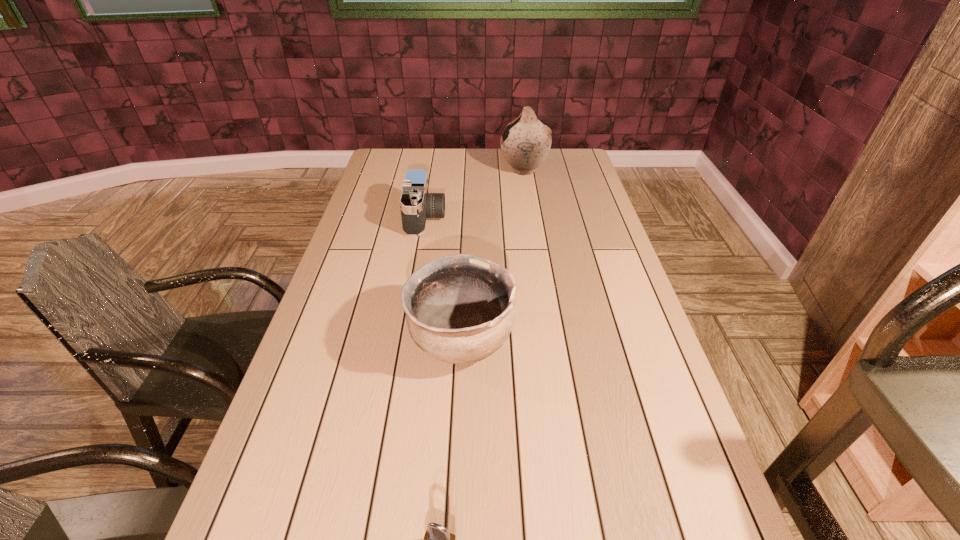
Image resolution: width=960 pixels, height=540 pixels. In order to click on the farther pottery in this screenshot , I will do `click(525, 143)`.

This screenshot has width=960, height=540. Find the location of `the farthest object`. the farthest object is located at coordinates (525, 143).

Where is `the nearer pottery`? The height and width of the screenshot is (540, 960). the nearer pottery is located at coordinates (460, 309).

This screenshot has height=540, width=960. Find the location of `the second nearest object`. the second nearest object is located at coordinates (460, 309).

The height and width of the screenshot is (540, 960). I want to click on the third tallest object, so click(x=416, y=204).

The image size is (960, 540). Identify the location of camera. (416, 204).

Locate an element on the screen. vacant space located 0.210m from the spout of the farthest object is located at coordinates (448, 170).

Find the location of a particular element. free spot located from the spout of the farthest object is located at coordinates (458, 170).

The image size is (960, 540). Find the location of `vacant area situated from the spout of the farthest object`. vacant area situated from the spout of the farthest object is located at coordinates (448, 170).

This screenshot has width=960, height=540. I want to click on free space located 0.090m on the back of the second nearest object, so click(464, 282).